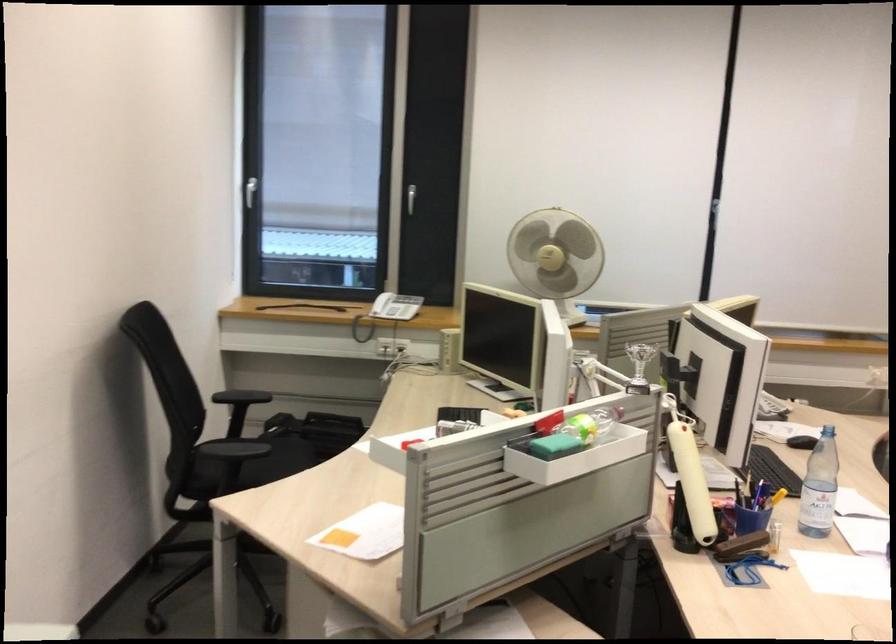
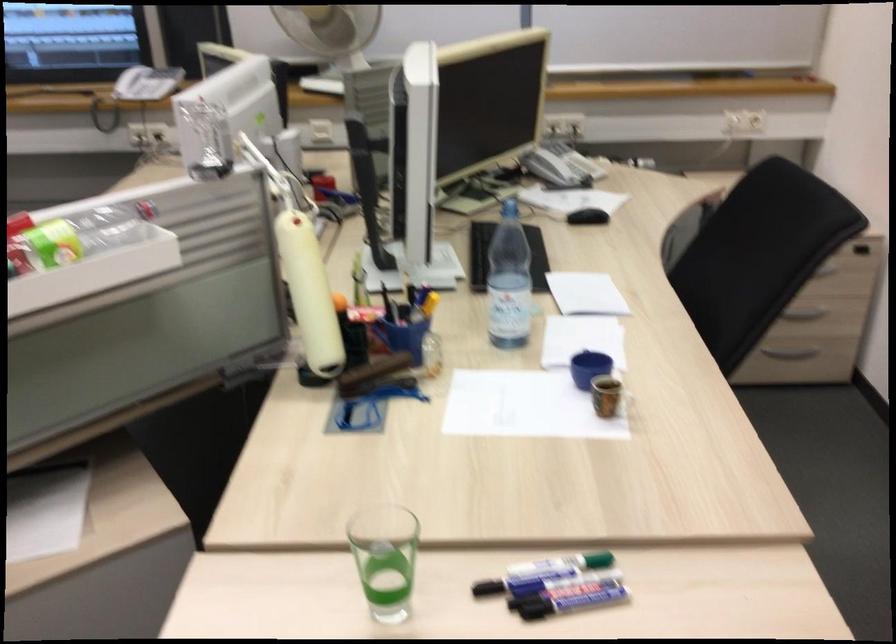
What movement of the cameraman would produce the second image?

The movement direction of the cameraman is right, forward.